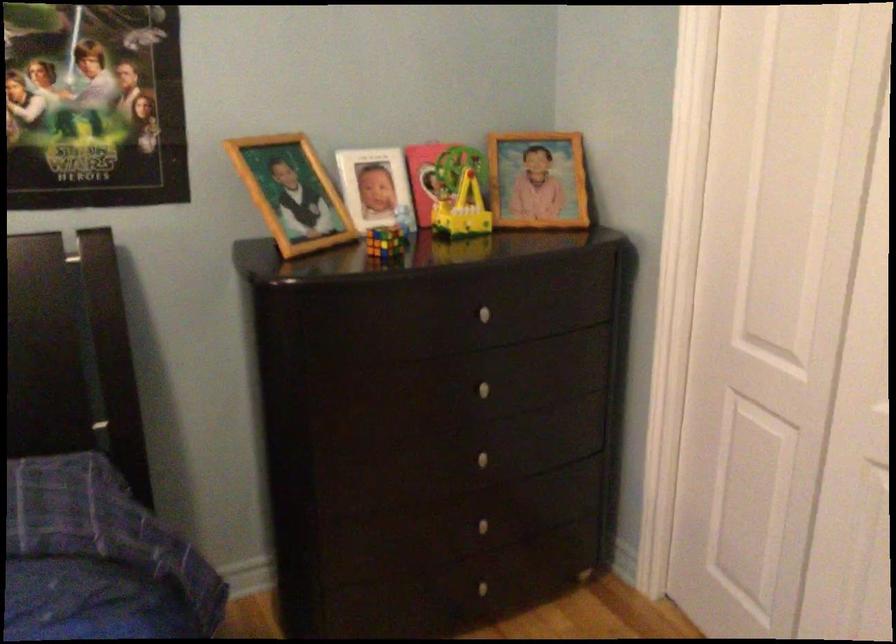
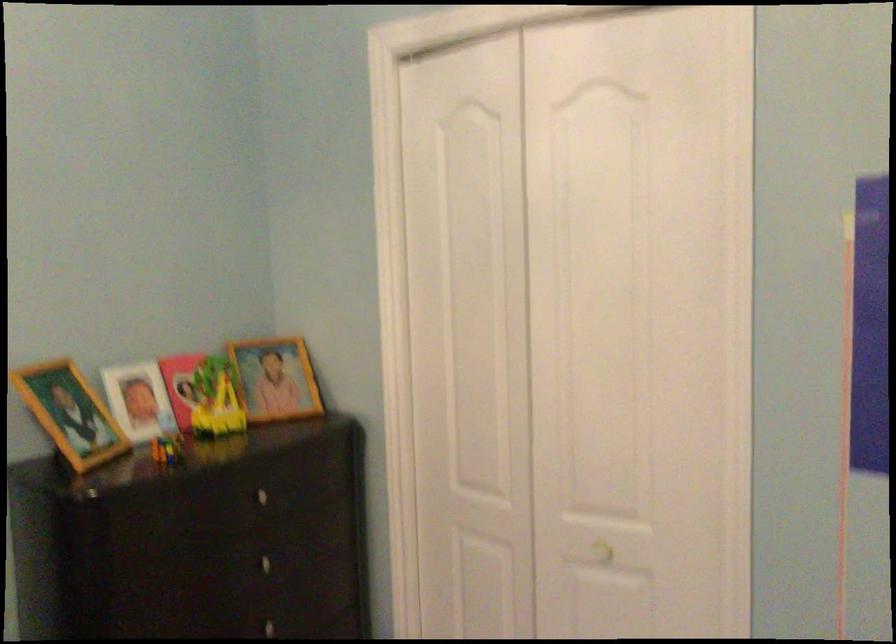
Question: The camera is either moving clockwise (left) or counter-clockwise (right) around the object. The first image is from the beginning of the video and the second image is from the end. Is the camera moving left or right when shooting the video?

Choices:
 (A) Left
 (B) Right

Answer: (A)